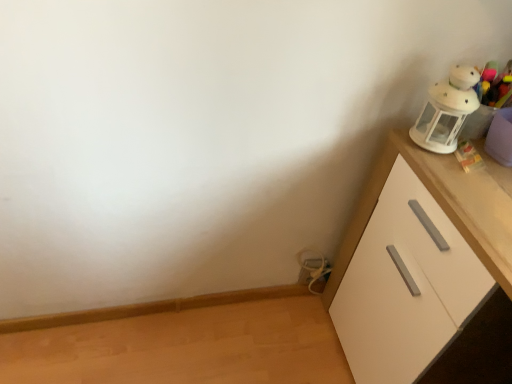
Where is `free spot in front of white plush toy at upper right, which is the second toy in bottom-to-top order`? The width and height of the screenshot is (512, 384). free spot in front of white plush toy at upper right, which is the second toy in bottom-to-top order is located at coordinates (459, 183).